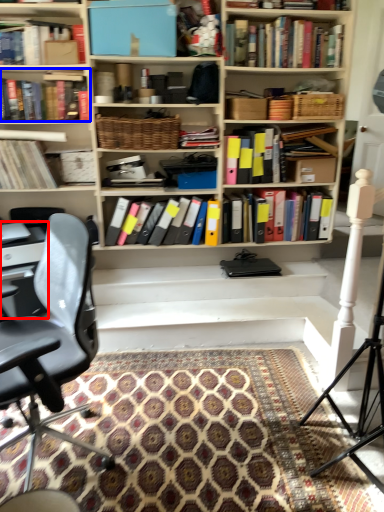
Question: Which object appears farthest to the camera in this image, computer desk (highlighted by a red box) or book (highlighted by a blue box)?

Choices:
 (A) computer desk
 (B) book

Answer: (B)